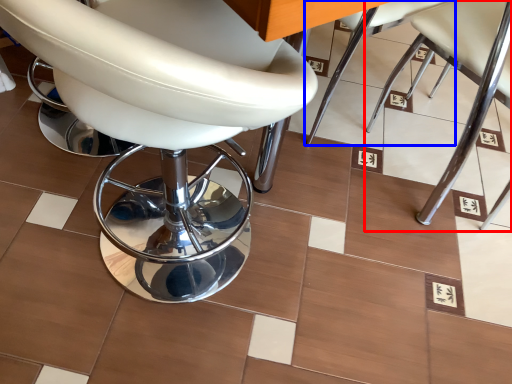
Question: Which object appears closest to the camera in this image, chair (highlighted by a red box) or chair (highlighted by a blue box)?

Choices:
 (A) chair
 (B) chair

Answer: (A)